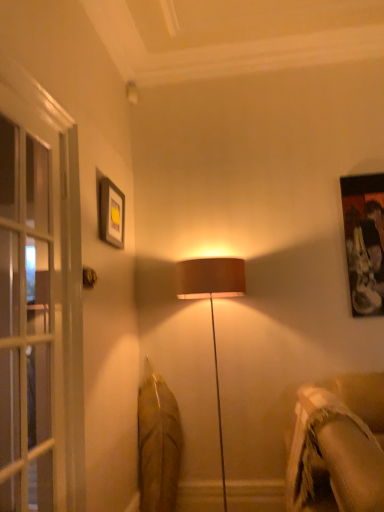
This screenshot has height=512, width=384. What do you see at coordinates (89, 277) in the screenshot?
I see `metallic gold door handle at upper left` at bounding box center [89, 277].

In order to click on matte black picture frame at upper left in this screenshot , I will do (111, 213).

From the image's perspective, is beige textured fabric couch at lower right on top of metallic gold door handle at upper left?

No, from the image's perspective, beige textured fabric couch at lower right is not on top of metallic gold door handle at upper left.

In the scene shown: Between beige textured fabric couch at lower right and metallic gold door handle at upper left, which one appears on the left side from the viewer's perspective?

metallic gold door handle at upper left.

Who is bigger, beige textured fabric couch at lower right or metallic gold door handle at upper left?

With larger size is beige textured fabric couch at lower right.

Is beige textured fabric couch at lower right inside or outside of metallic gold door handle at upper left?

beige textured fabric couch at lower right is not inside metallic gold door handle at upper left, it's outside.

Considering the sizes of objects matte black picture frame at upper left and metallic gold door handle at upper left in the image provided, who is wider, matte black picture frame at upper left or metallic gold door handle at upper left?

matte black picture frame at upper left.

From the image's perspective, between matte black picture frame at upper left and metallic gold door handle at upper left, who is located below?

metallic gold door handle at upper left, from the image's perspective.

Would you consider matte black picture frame at upper left to be distant from metallic gold door handle at upper left?

No, there isn't a large distance between matte black picture frame at upper left and metallic gold door handle at upper left.

Find the location of a particular element. This screenshot has width=384, height=512. picture frame above the metallic gold door handle at upper left (from a real-world perspective) is located at coordinates tap(111, 213).

Considering the positions of objects beige textured fabric couch at lower right and clear glass screen door at left in the image provided, who is behind, beige textured fabric couch at lower right or clear glass screen door at left?

beige textured fabric couch at lower right is more distant.

From a real-world perspective, is beige textured fabric couch at lower right physically above clear glass screen door at left?

Actually, beige textured fabric couch at lower right is physically below clear glass screen door at left in the real world.

Based on the photo, considering the relative sizes of beige textured fabric couch at lower right and clear glass screen door at left in the image provided, is beige textured fabric couch at lower right bigger than clear glass screen door at left?

Indeed, beige textured fabric couch at lower right has a larger size compared to clear glass screen door at left.

Choose the correct answer: Is beige textured fabric couch at lower right inside clear glass screen door at left or outside it?

The correct answer is: outside.

Is point (116, 234) positioned before point (71, 479)?

No, it is not.

Is matte black picture frame at upper left wider or thinner than clear glass screen door at left?

matte black picture frame at upper left is thinner than clear glass screen door at left.

From the image's perspective, is matte black picture frame at upper left located above or below clear glass screen door at left?

From the image's perspective, matte black picture frame at upper left appears above clear glass screen door at left.

Which object is more forward, clear glass screen door at left or beige textured fabric couch at lower right?

clear glass screen door at left is in front.

From a real-world perspective, which object stands above the other?

From a 3D spatial view, clear glass screen door at left is above.

Is clear glass screen door at left facing away from beige textured fabric couch at lower right?

No, clear glass screen door at left is not facing away from beige textured fabric couch at lower right.

Looking at the image, does clear glass screen door at left seem bigger or smaller compared to beige textured fabric couch at lower right?

In the image, clear glass screen door at left appears to be smaller than beige textured fabric couch at lower right.

Between matte black picture frame at upper left and beige textured fabric couch at lower right, which one is positioned in front?

Positioned in front is beige textured fabric couch at lower right.

Is matte black picture frame at upper left at the left side of beige textured fabric couch at lower right?

Yes.

Is matte black picture frame at upper left looking in the opposite direction of beige textured fabric couch at lower right?

No, beige textured fabric couch at lower right is not at the back of matte black picture frame at upper left.

From the image's perspective, would you say clear glass screen door at left is shown under matte black picture frame at upper left?

Indeed, from the image's perspective, clear glass screen door at left is shown beneath matte black picture frame at upper left.

Is clear glass screen door at left shorter than matte black picture frame at upper left?

No.

Considering the sizes of clear glass screen door at left and matte black picture frame at upper left in the image, is clear glass screen door at left wider or thinner than matte black picture frame at upper left?

Considering their sizes, clear glass screen door at left looks broader than matte black picture frame at upper left.

Identify the location of studio couch below the metallic gold door handle at upper left (from a real-world perspective). Image resolution: width=384 pixels, height=512 pixels. (339, 443).

Identify the location of door handle that is on the left side of matte black picture frame at upper left. This screenshot has height=512, width=384. (89, 277).

Based on their spatial positions, is matte black picture frame at upper left or clear glass screen door at left closer to beige textured fabric couch at lower right?

clear glass screen door at left lies closer to beige textured fabric couch at lower right than the other object.

Looking at the image, which one is located further to beige textured fabric couch at lower right, metallic gold door handle at upper left or matte black picture frame at upper left?

matte black picture frame at upper left is positioned further to the anchor beige textured fabric couch at lower right.

Estimate the real-world distances between objects in this image. Which object is further from clear glass screen door at left, matte black picture frame at upper left or beige textured fabric couch at lower right?

beige textured fabric couch at lower right.

Considering their positions, is metallic gold door handle at upper left positioned further to matte black picture frame at upper left than beige textured fabric couch at lower right?

Among the two, beige textured fabric couch at lower right is located further to matte black picture frame at upper left.

From the image, which object appears to be nearer to metallic gold door handle at upper left, beige textured fabric couch at lower right or clear glass screen door at left?

clear glass screen door at left is positioned closer to the anchor metallic gold door handle at upper left.

Estimate the real-world distances between objects in this image. Which object is closer to matte black picture frame at upper left, beige textured fabric couch at lower right or clear glass screen door at left?

clear glass screen door at left is positioned closer to the anchor matte black picture frame at upper left.

Based on their spatial positions, is clear glass screen door at left or metallic gold door handle at upper left further from matte black picture frame at upper left?

Among the two, clear glass screen door at left is located further to matte black picture frame at upper left.

Looking at the image, which one is located further to clear glass screen door at left, metallic gold door handle at upper left or matte black picture frame at upper left?

matte black picture frame at upper left is further to clear glass screen door at left.

Locate an element on the screen. The width and height of the screenshot is (384, 512). door handle positioned between clear glass screen door at left and matte black picture frame at upper left from near to far is located at coordinates (89, 277).

This screenshot has height=512, width=384. I want to click on picture frame between clear glass screen door at left and beige textured fabric couch at lower right from left to right, so click(111, 213).

Locate an element on the screen. The height and width of the screenshot is (512, 384). picture frame located between metallic gold door handle at upper left and beige textured fabric couch at lower right in the left-right direction is located at coordinates (111, 213).

Where is `door handle situated between clear glass screen door at left and beige textured fabric couch at lower right from left to right`? door handle situated between clear glass screen door at left and beige textured fabric couch at lower right from left to right is located at coordinates (89, 277).